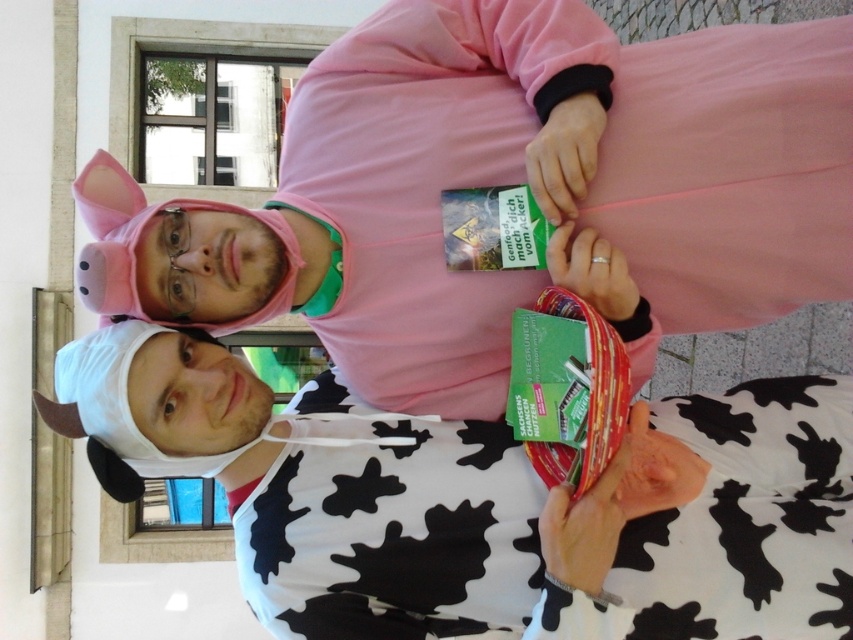
Between pink fleece at upper center and white cow print hoodie at center, which one is positioned lower?

white cow print hoodie at center

Which is behind, point (252, 236) or point (650, 564)?

The point (252, 236) is more distant.

At what (x,y) coordinates should I click in order to perform the action: click on pink fleece at upper center. Please return your answer as a coordinate pair (x, y). Image resolution: width=853 pixels, height=640 pixels. Looking at the image, I should click on (503, 188).

Identify the location of pink fleece at upper center. This screenshot has width=853, height=640. (503, 188).